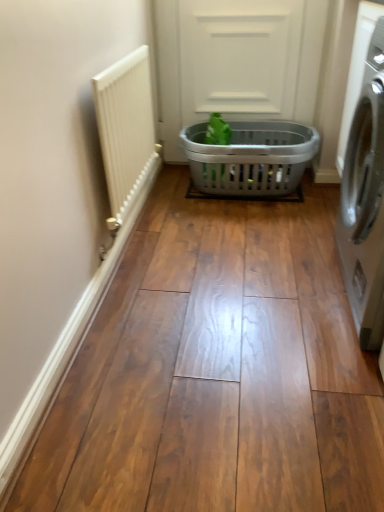
Identify the location of free space between satin silver washing machine at right and gray plastic laundry basket at center. The width and height of the screenshot is (384, 512). (265, 243).